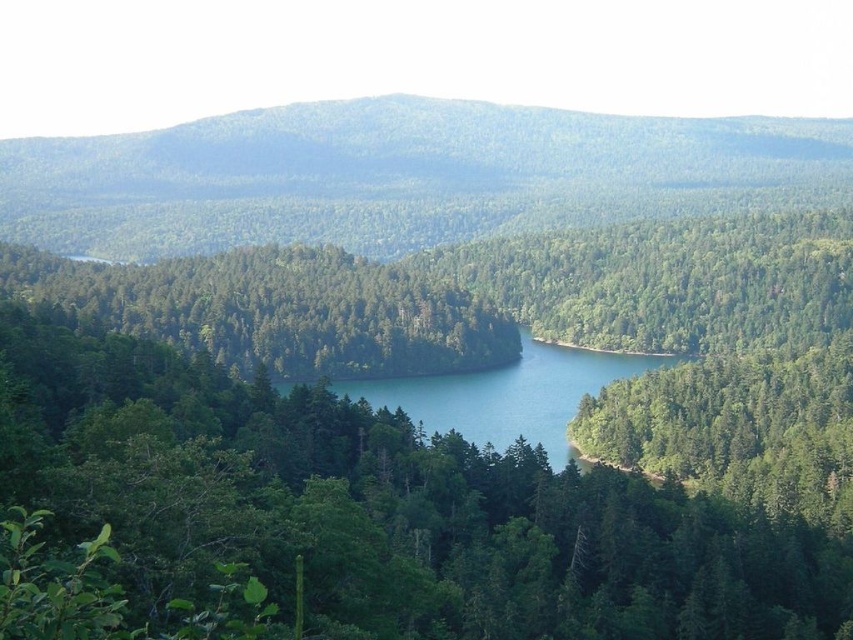
Question: Is green matte tree at center to the right of green forested mountain at upper center from the viewer's perspective?

Choices:
 (A) yes
 (B) no

Answer: (B)

Question: Can you confirm if green matte tree at center is positioned above green forested mountain at upper center?

Choices:
 (A) no
 (B) yes

Answer: (A)

Question: Which object is farther from the camera taking this photo?

Choices:
 (A) green forested mountain at upper center
 (B) green matte tree at center

Answer: (A)

Question: Which object is closer to the camera taking this photo?

Choices:
 (A) green forested mountain at upper center
 (B) green matte tree at center

Answer: (B)

Question: Among these points, which one is farthest from the camera?

Choices:
 (A) (776, 189)
 (B) (161, 298)

Answer: (A)

Question: Is green matte tree at center wider than green forested mountain at upper center?

Choices:
 (A) yes
 (B) no

Answer: (B)